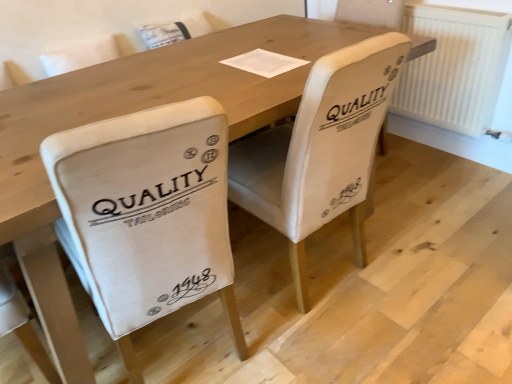
Locate an element on the screen. The height and width of the screenshot is (384, 512). free point in front of white paper at center is located at coordinates (258, 80).